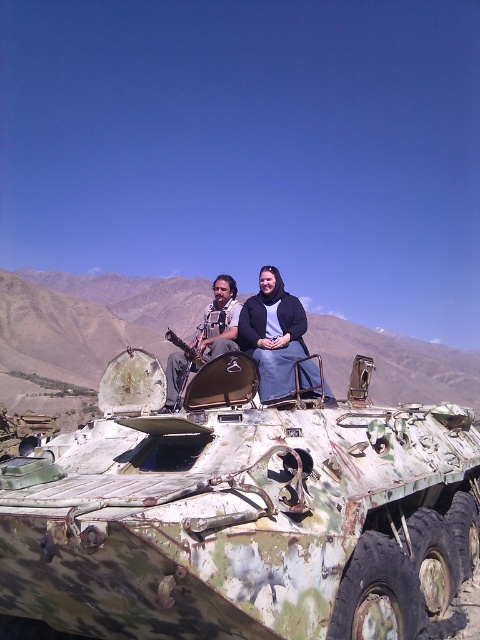
Question: Does camouflage paint tank at center have a lesser width compared to matte black rifle at upper center?

Choices:
 (A) yes
 (B) no

Answer: (B)

Question: Among these points, which one is nearest to the camera?

Choices:
 (A) pyautogui.click(x=72, y=568)
 (B) pyautogui.click(x=307, y=349)
 (C) pyautogui.click(x=218, y=289)

Answer: (A)

Question: Which point appears closest to the camera in this image?

Choices:
 (A) (290, 616)
 (B) (228, 349)
 (C) (259, 284)

Answer: (A)

Question: Is camouflage paint tank at center to the right of matte black rifle at upper center from the viewer's perspective?

Choices:
 (A) no
 (B) yes

Answer: (A)

Question: Does matte black jacket at center appear on the left side of matte black rifle at upper center?

Choices:
 (A) no
 (B) yes

Answer: (A)

Question: Estimate the real-world distances between objects in this image. Which object is farther from the matte black rifle at upper center?

Choices:
 (A) matte black jacket at center
 (B) camouflage paint tank at center

Answer: (A)